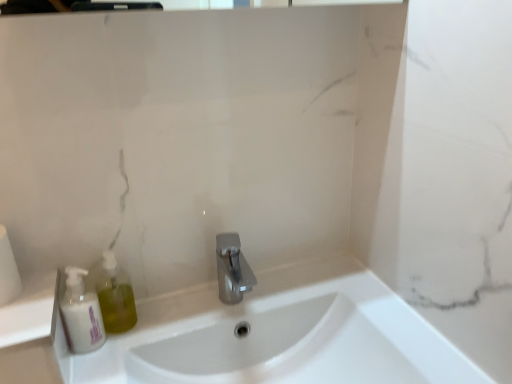
Question: Is white matte bottle at left inside the boundaries of polished metallic faucet at center, or outside?

Choices:
 (A) inside
 (B) outside

Answer: (B)

Question: From a real-world perspective, is white matte bottle at left physically located above or below polished metallic faucet at center?

Choices:
 (A) above
 (B) below

Answer: (A)

Question: Which object is the farthest from the white glossy sink at center?

Choices:
 (A) polished metallic faucet at center
 (B) white matte bottle at left
 (C) white matte toilet paper at left

Answer: (C)

Question: Considering the real-world distances, which object is closest to the white matte bottle at left?

Choices:
 (A) white glossy sink at center
 (B) white matte toilet paper at left
 (C) polished metallic faucet at center

Answer: (B)